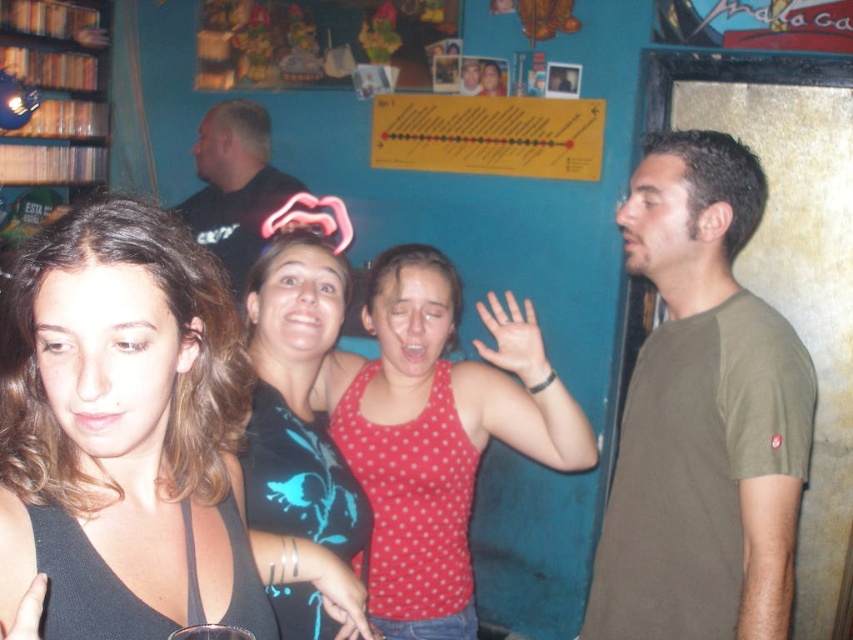
Question: Is black matte tank top at left to the right of black cotton shirt at upper left from the viewer's perspective?

Choices:
 (A) no
 (B) yes

Answer: (B)

Question: Which of the following is the closest to the observer?

Choices:
 (A) polka dot tank top at center
 (B) black matte tank top at left

Answer: (B)

Question: Which point is farther from the camera taking this photo?

Choices:
 (A) (323, 432)
 (B) (532, 426)
 (C) (135, 273)

Answer: (B)

Question: Does polka dot tank top at center appear on the right side of black cotton shirt at upper left?

Choices:
 (A) no
 (B) yes

Answer: (B)

Question: Which point is farther to the camera?

Choices:
 (A) (24, 481)
 (B) (399, 381)

Answer: (B)

Question: Does green cotton t-shirt at right lie behind black cotton shirt at upper left?

Choices:
 (A) yes
 (B) no

Answer: (B)